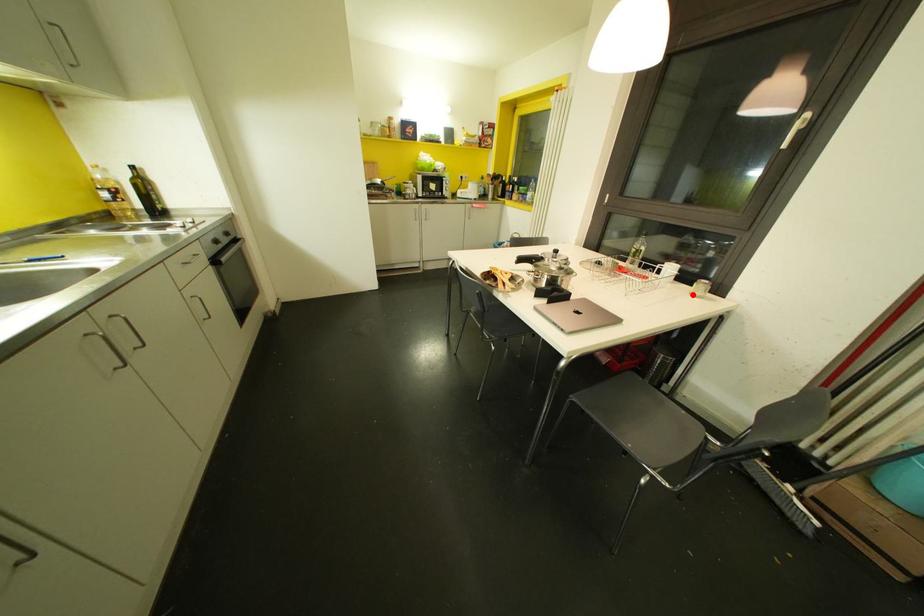
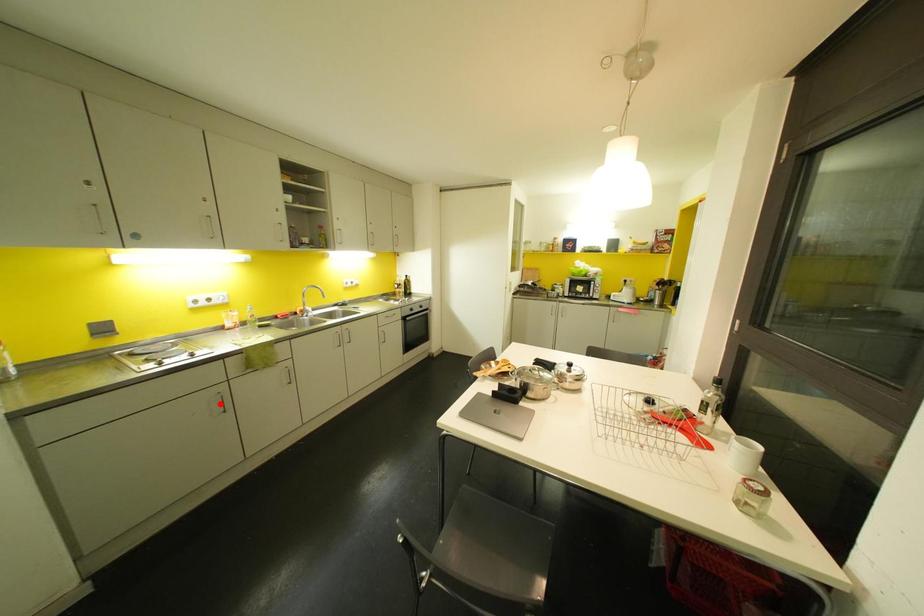
I am providing you with two images of the same scene from different viewpoints. A red point is marked on the first image and another point is marked on the second image. Is the red point in image1 aligned with the point shown in image2?

No